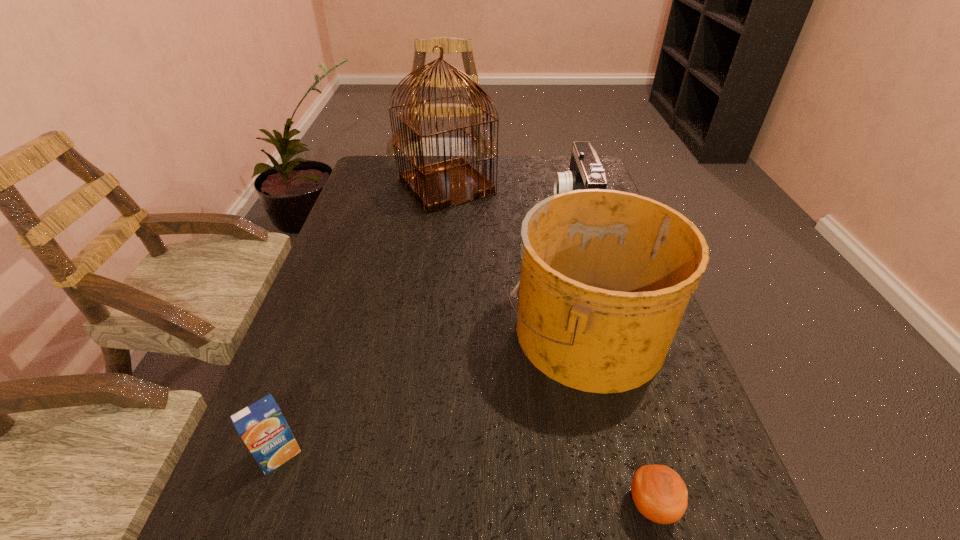
Where is `bucket that is at the right edge`? bucket that is at the right edge is located at coordinates (606, 275).

At what (x,y) coordinates should I click in order to perform the action: click on camcorder that is at the right edge. Please return your answer as a coordinate pair (x, y). Looking at the image, I should click on (585, 172).

Image resolution: width=960 pixels, height=540 pixels. I want to click on orange at the right edge, so click(659, 493).

Find the location of `object that is positioned at the far left corner`. object that is positioned at the far left corner is located at coordinates (445, 184).

At what (x,y) coordinates should I click in order to perform the action: click on object that is at the far right corner. Please return your answer as a coordinate pair (x, y). Looking at the image, I should click on (585, 172).

Locate an element on the screen. The image size is (960, 540). vacant area at the far edge of the desktop is located at coordinates (498, 157).

What are the coordinates of `vacant space at the left edge of the desktop` in the screenshot? It's located at (348, 212).

In the image, there is a desktop. At what (x,y) coordinates should I click in order to perform the action: click on vacant space at the far left corner. Please return your answer as a coordinate pair (x, y). Looking at the image, I should click on (401, 188).

Locate an element on the screen. The height and width of the screenshot is (540, 960). vacant space that is in between the bucket and the birdcage is located at coordinates (516, 258).

I want to click on free spot between the fourth tallest object and the orange, so click(x=466, y=480).